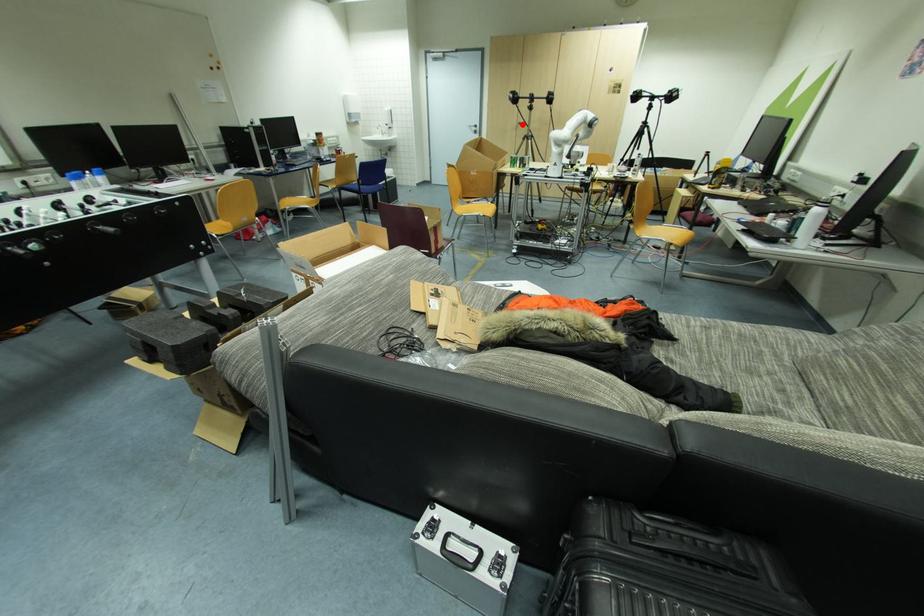
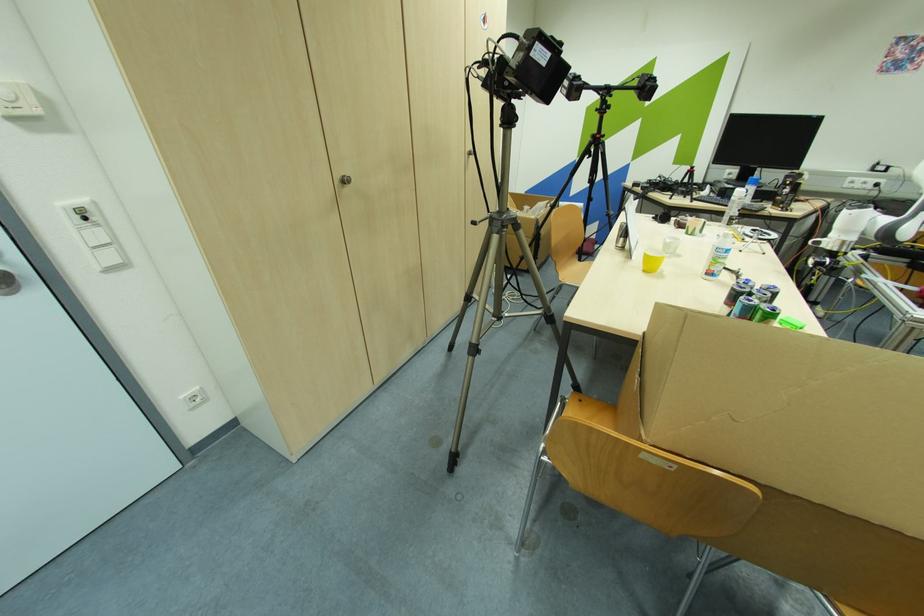
The point at the highlighted location is marked in the first image. Where is the corresponding point in the second image?

(348, 182)